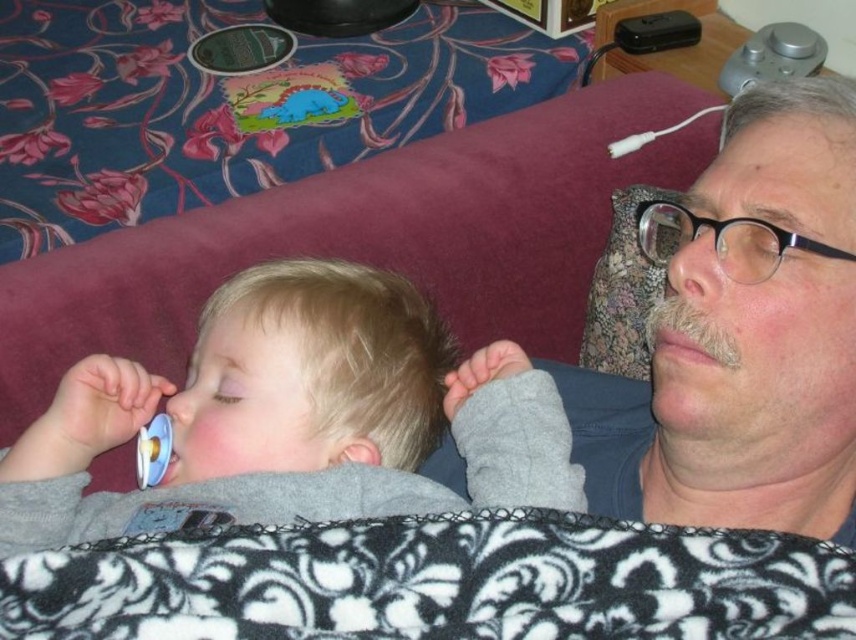
Question: Can you confirm if dry skin at center is thinner than white plastic pacifier at lower left?

Choices:
 (A) yes
 (B) no

Answer: (B)

Question: Is gray fleece baby at center positioned behind white plastic pacifier at lower left?

Choices:
 (A) no
 (B) yes

Answer: (A)

Question: Which object appears farthest from the camera in this image?

Choices:
 (A) matte gray shirt at upper right
 (B) gray fleece baby at center

Answer: (B)

Question: Which point appears farthest from the camera in this image?

Choices:
 (A) coord(688,328)
 (B) coord(513,344)

Answer: (B)

Question: Which of these objects is positioned farthest from the dry skin at center?

Choices:
 (A) gray fleece baby at center
 (B) matte gray shirt at upper right
 (C) white plastic pacifier at lower left

Answer: (C)

Question: Is dry skin at center below white plastic pacifier at lower left?

Choices:
 (A) yes
 (B) no

Answer: (B)